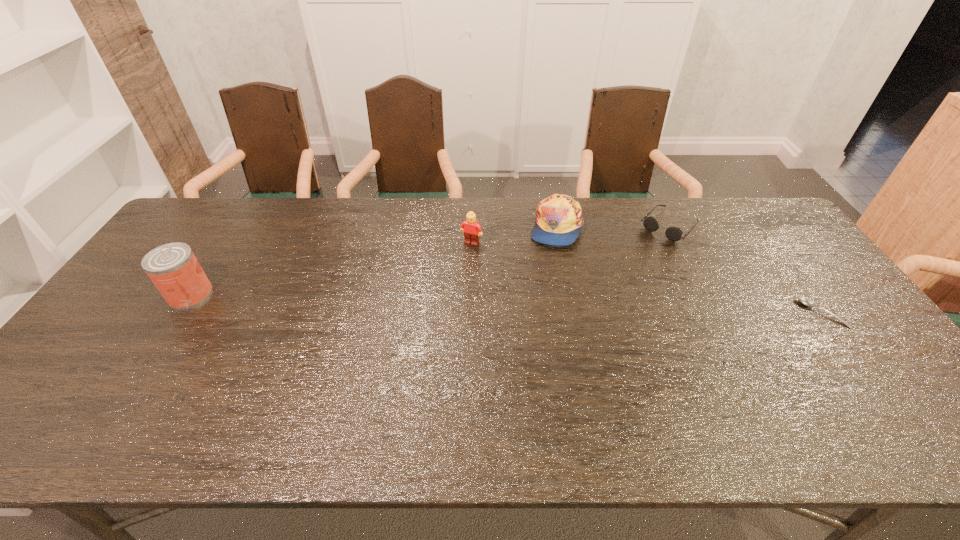
Find the location of `object that can be found as the third closest to the shortest object`. object that can be found as the third closest to the shortest object is located at coordinates (471, 229).

In order to click on object identified as the second closest to the leftmost object in this screenshot , I will do tap(559, 219).

Locate an element on the screen. vacant region that satisfies the following two spatial constraints: 1. on the back side of the fourth object from right to left; 2. on the right side of the leftmost object is located at coordinates (224, 243).

Identify the location of vacant region that satisfies the following two spatial constraints: 1. on the front side of the rightmost object; 2. on the left side of the cap. 573,313.